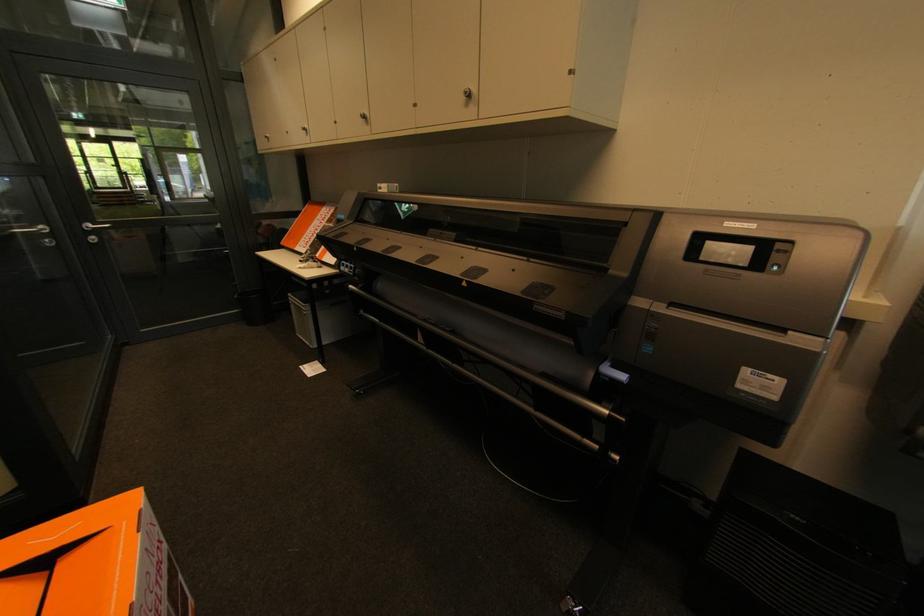
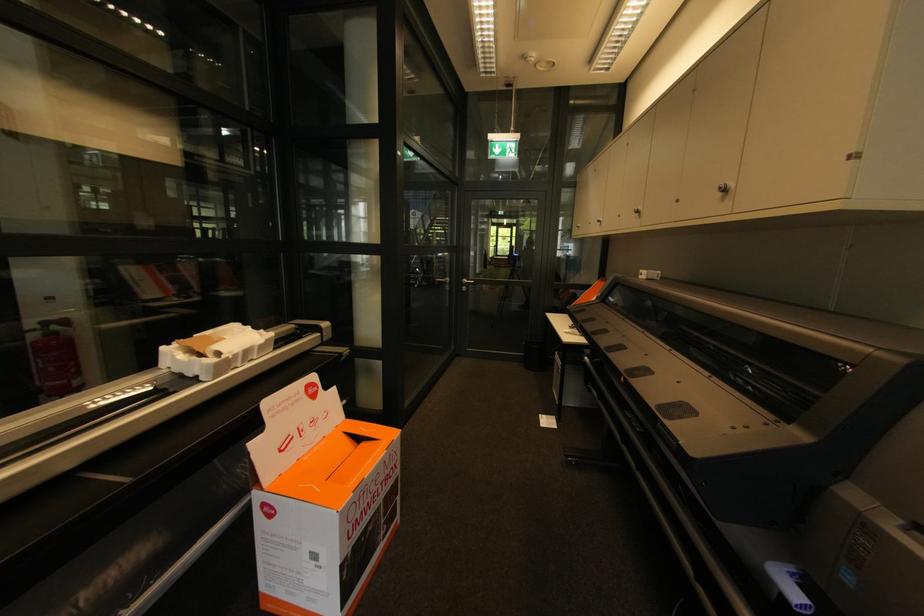
Locate, in the second image, the point that corresponds to the point at 368,119 in the first image.

(640, 214)